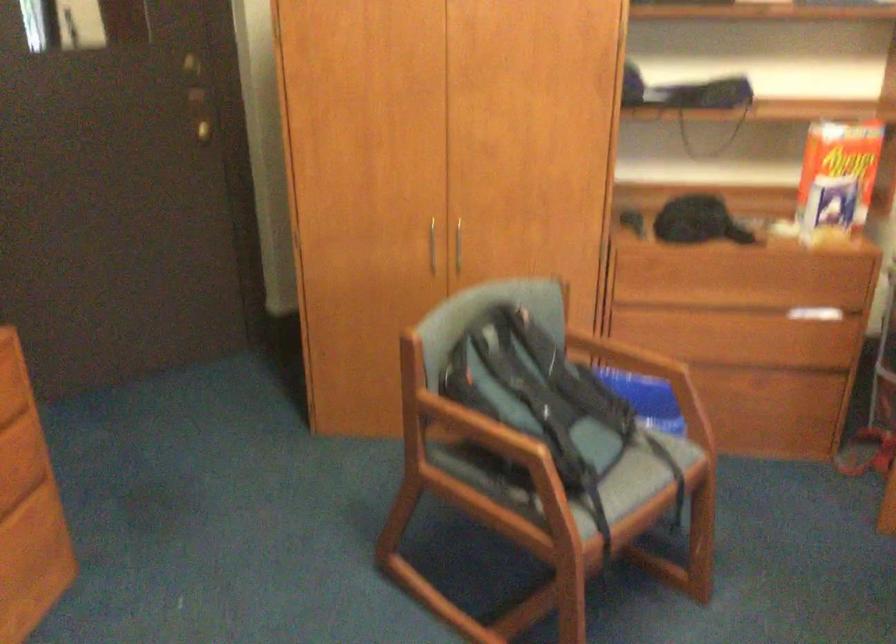
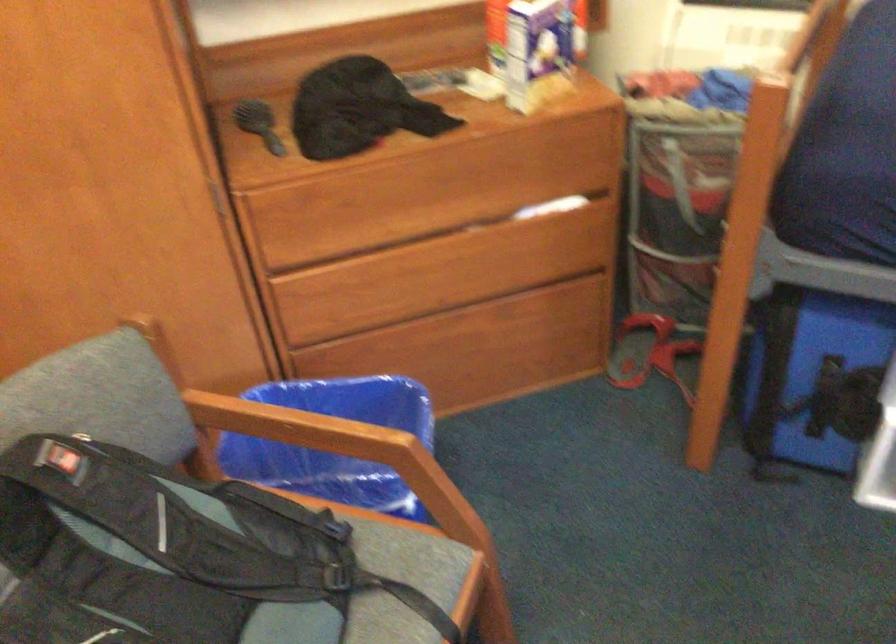
The point at (639,371) is marked in the first image. Where is the corresponding point in the second image?

(334, 440)